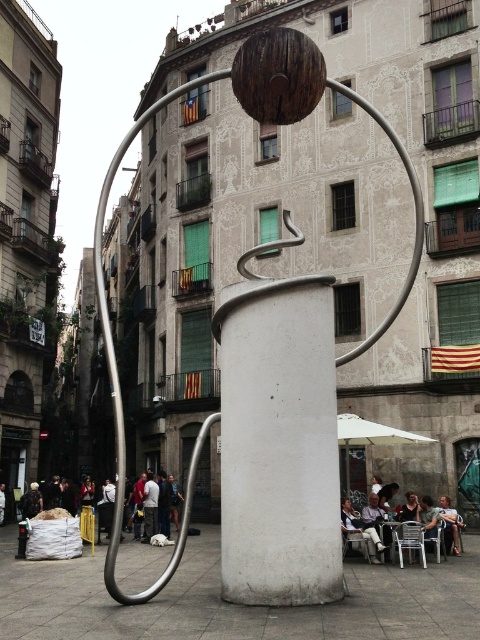
Which is more to the left, white matte pillar at center or light brown leather jacket at lower right?

From the viewer's perspective, white matte pillar at center appears more on the left side.

Between point (297, 509) and point (447, 497), which one is positioned in front?

Positioned in front is point (297, 509).

Does point (285, 449) come farther from viewer compared to point (453, 536)?

No, it is in front of (453, 536).

Locate an element on the screen. white matte pillar at center is located at coordinates (278, 436).

Between matte white chair at lower center and white fabric chair at lower right, which one has more height?

matte white chair at lower center is taller.

Does matte white chair at lower center appear under white fabric chair at lower right?

Indeed, matte white chair at lower center is positioned under white fabric chair at lower right.

What do you see at coordinates (430, 518) in the screenshot? I see `matte white chair at lower center` at bounding box center [430, 518].

The width and height of the screenshot is (480, 640). What are the coordinates of `matte white chair at lower center` in the screenshot? It's located at (430, 518).

Is white matte pillar at center below dark gray jacket at lower left?

No.

Based on the photo, between white matte pillar at center and dark gray jacket at lower left, which one has more height?

Standing taller between the two is white matte pillar at center.

Is point (223, 496) positioned in front of point (32, 509)?

Yes, it is in front of point (32, 509).

Where is `white matte pillar at center`? This screenshot has height=640, width=480. white matte pillar at center is located at coordinates (278, 436).